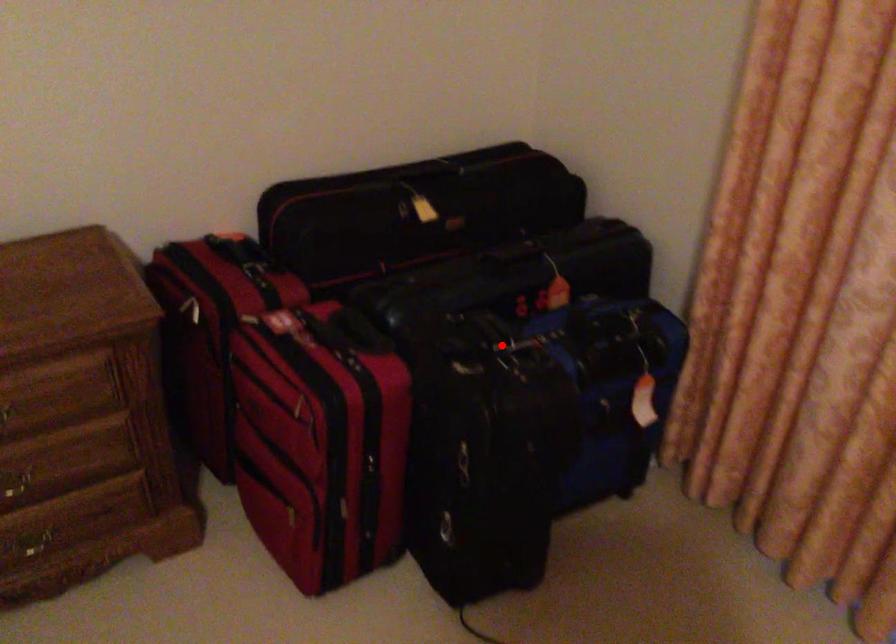
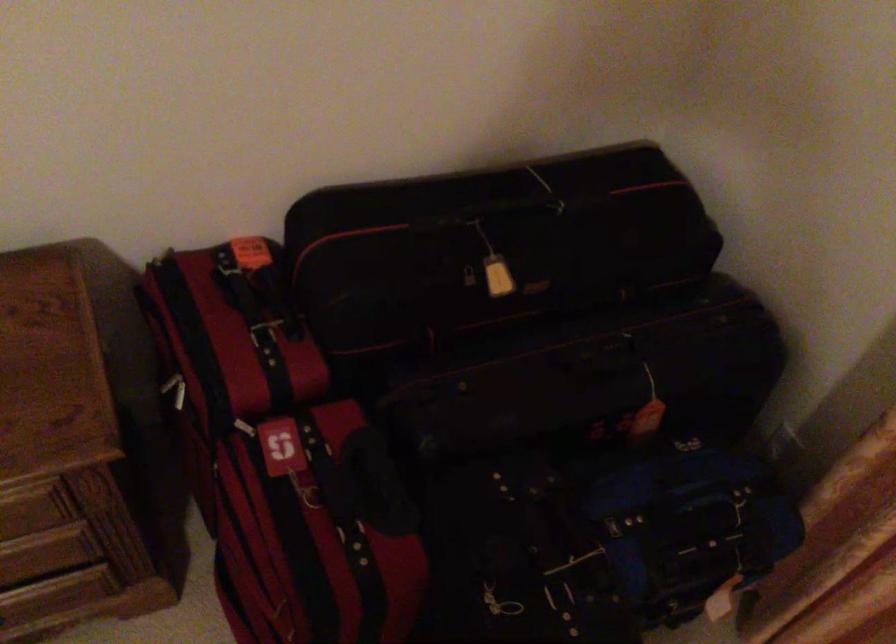
Question: A red point is marked in image1. In image2, is the corresponding 3D point closer to the camera or farther? Reply with the corresponding letter.

Choices:
 (A) The corresponding 3D point is closer.
 (B) The corresponding 3D point is farther.

Answer: (A)